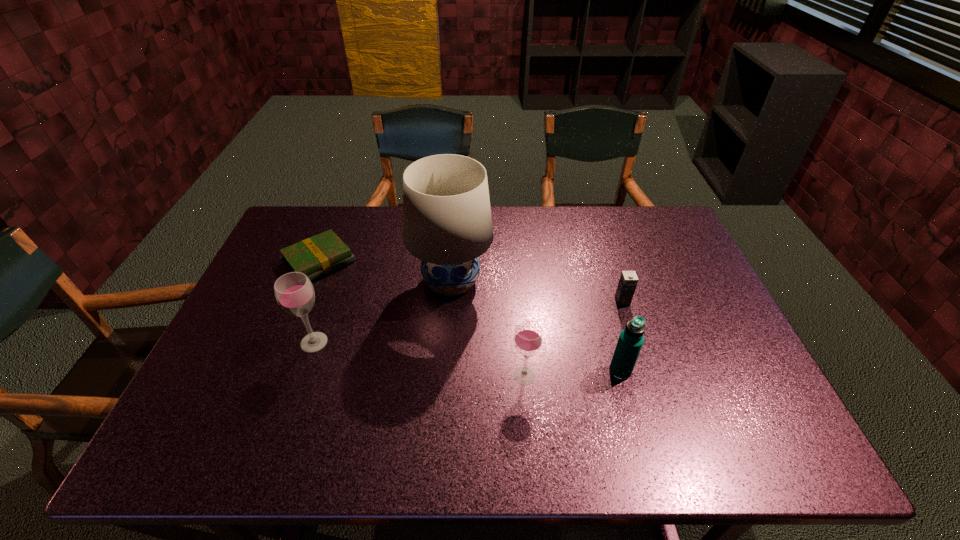
The height and width of the screenshot is (540, 960). I want to click on unoccupied position between the shortest object and the taller wineglass, so click(x=317, y=302).

At what (x,y) coordinates should I click in order to perform the action: click on vacant space in between the book and the nearer wineglass. Please return your answer as a coordinate pair (x, y). This screenshot has height=540, width=960. Looking at the image, I should click on (421, 319).

Find the location of a particular element. free space between the second object from right to left and the right wineglass is located at coordinates [572, 374].

Select which object is the fifth closest to the shortest object. Please provide its 2D coordinates. Your answer should be formatted as a tuple, i.e. [(x, y)], where the tuple contains the x and y coordinates of a point satisfying the conditions above.

[(628, 281)]

Find the location of a particular element. The height and width of the screenshot is (540, 960). object that ranks as the fifth closest to the water bottle is located at coordinates (316, 256).

Where is `free space that satisfies the following two spatial constraints: 1. on the front side of the left wineglass; 2. on the left side of the book`? This screenshot has height=540, width=960. free space that satisfies the following two spatial constraints: 1. on the front side of the left wineglass; 2. on the left side of the book is located at coordinates (286, 342).